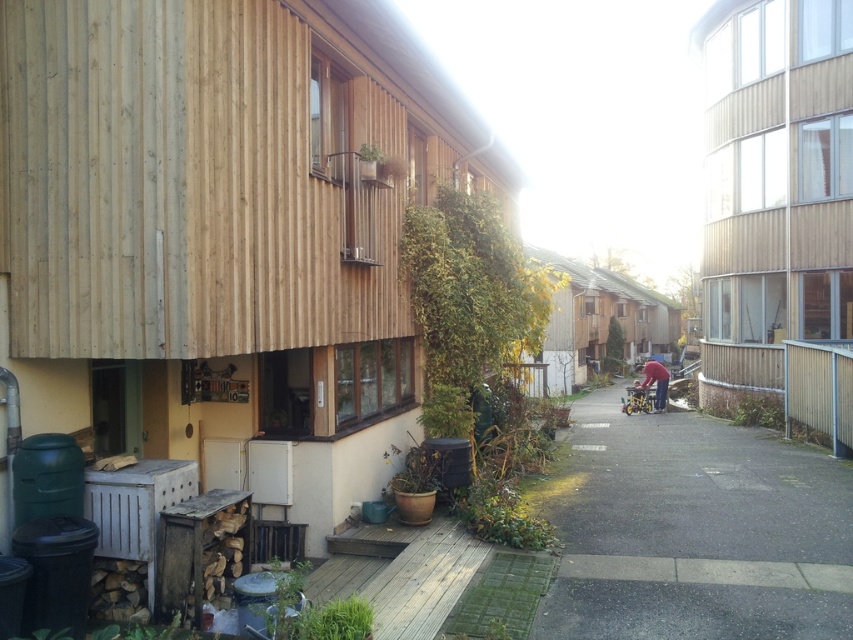
You are standing at the wooden deck area and want to walk towards the yellow door. There are two points marked on the ground labeled point (767, 483) and point (648, 396). Which point should you step on first to reach the yellow door?

You should step on point (767, 483) first because it is in front of point (648, 396), meaning it is closer to your current position at the wooden deck area and the yellow door is in that direction.